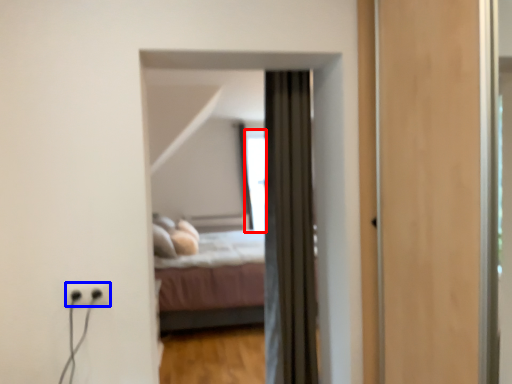
Question: Which of the following is the farthest to the observer, window (highlighted by a red box) or electric outlet (highlighted by a blue box)?

Choices:
 (A) window
 (B) electric outlet

Answer: (A)